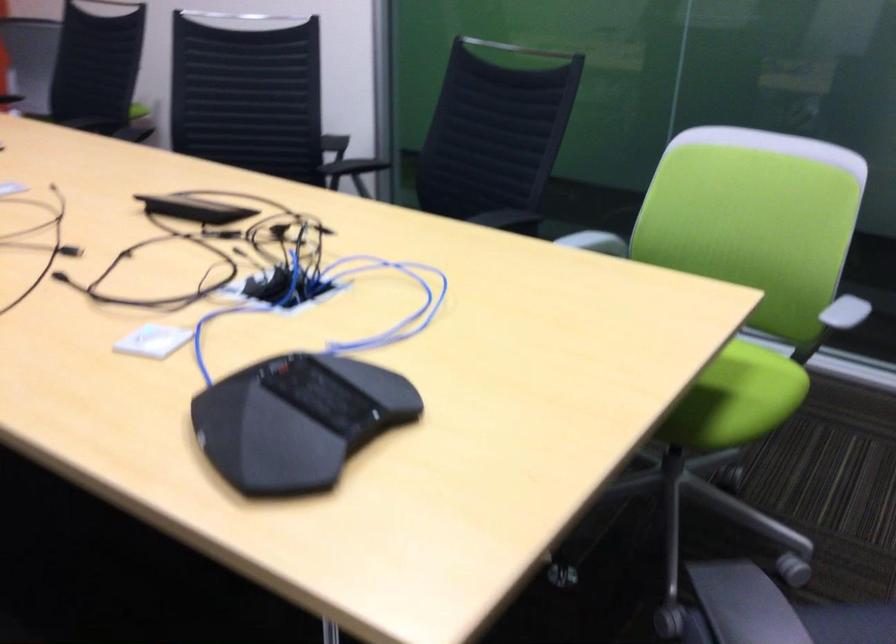
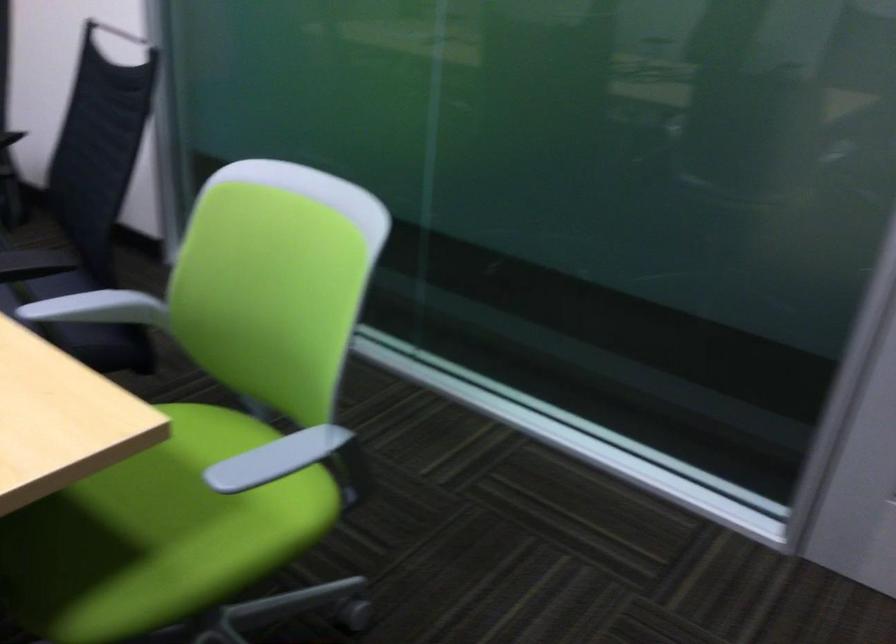
Locate, in the second image, the point that corresponds to (x=709, y=386) in the first image.

(157, 534)